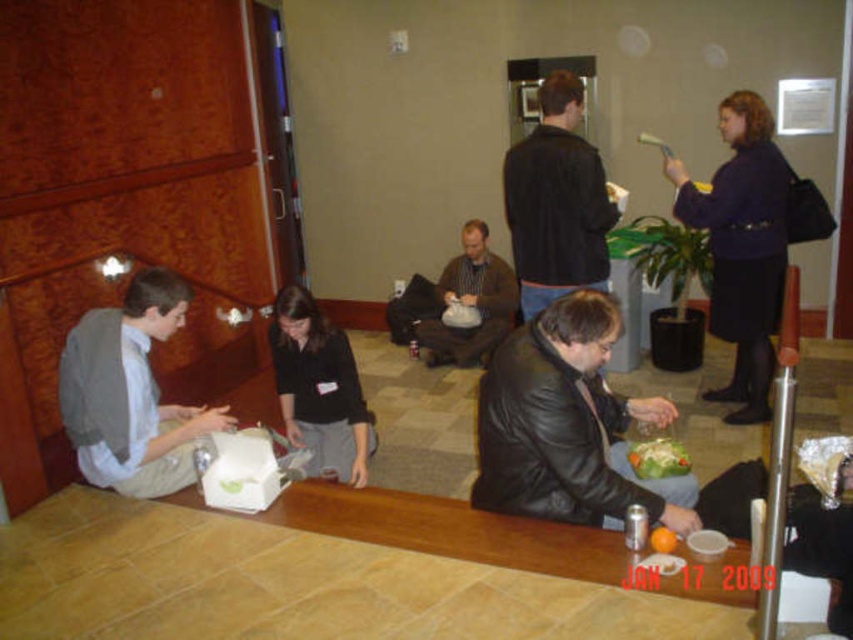
You are a photographer taking a picture of the scene. You want to focus on the gray fabric shirt at lower left and the green leafy salad at lower center. Which object is located to the left of the other?

The gray fabric shirt at lower left is positioned on the left side of green leafy salad at lower center.

You are standing in the hotel lobby and need to place a small plant between the two points, point (117, 346) and point (666, 452). Which point should you place it closer to so that it is still visible from your current position?

You should place the small plant closer to point (117, 346) because it is closer to you than point (666, 452), making it more visible from your current position.

You are a photographer trying to capture a closeup shot of the green leafy salad at lower center without including the gray fabric shirt at lower left in the frame. Given their sizes, is this possible?

The gray fabric shirt at lower left is bigger than the green leafy salad at lower center, so it might be challenging to frame the salad without including the shirt if they are positioned closely. Adjust your angle or move closer to focus solely on the salad.